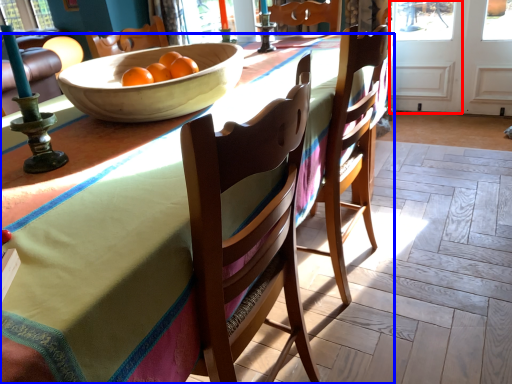
Question: Which point is further to the camera, screen door (highlighted by a red box) or desk (highlighted by a blue box)?

Choices:
 (A) screen door
 (B) desk

Answer: (A)